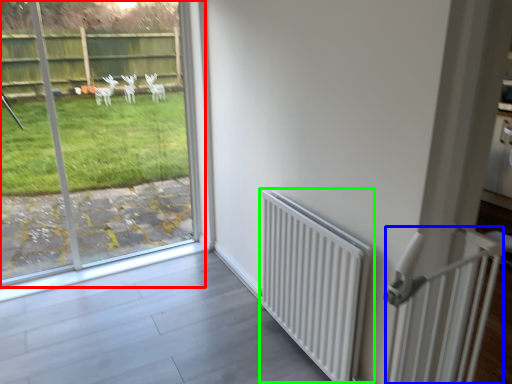
Question: Which is nearer to the window (highlighted by a red box)? balustrade (highlighted by a blue box) or radiator (highlighted by a green box).

Choices:
 (A) balustrade
 (B) radiator

Answer: (B)